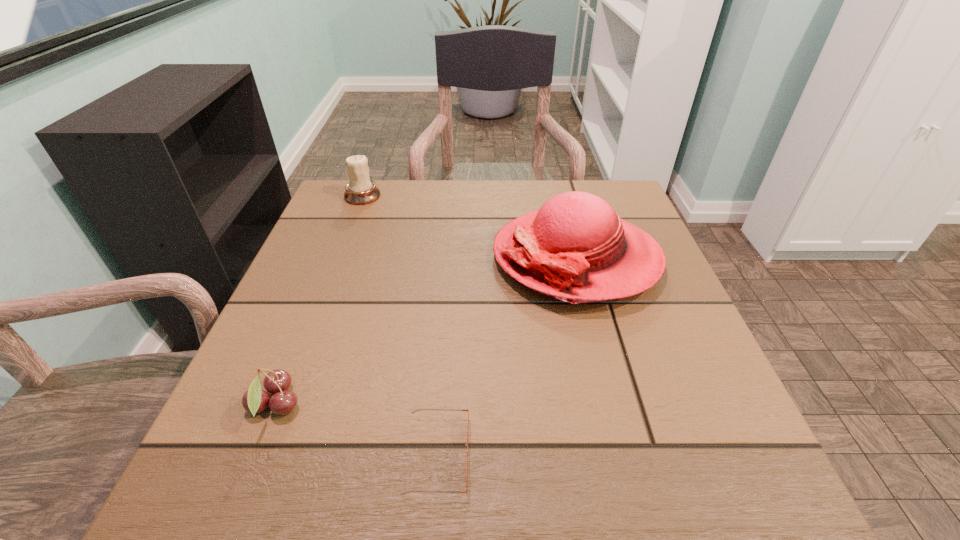
I want to click on object at the far right corner, so click(x=575, y=248).

At what (x,y) coordinates should I click in order to perform the action: click on vacant space at the far edge. Please return your answer as a coordinate pair (x, y). Looking at the image, I should click on (558, 180).

Where is `vacant space at the near edge of the desktop`? The image size is (960, 540). vacant space at the near edge of the desktop is located at coordinates (328, 463).

The height and width of the screenshot is (540, 960). Identify the location of free region at the left edge of the desktop. (351, 271).

Image resolution: width=960 pixels, height=540 pixels. I want to click on free spot at the far left corner of the desktop, so click(380, 226).

This screenshot has height=540, width=960. In the image, there is a desktop. What are the coordinates of `vacant space at the near left corner` in the screenshot? It's located at (288, 466).

Find the location of a particular element. The width and height of the screenshot is (960, 540). free space at the near right corner is located at coordinates (683, 463).

In order to click on vacant point located between the candle holder and the second shortest object in this screenshot , I will do point(319,300).

This screenshot has height=540, width=960. What are the coordinates of `free spot between the shortest object and the cherry` in the screenshot? It's located at (356, 430).

Where is `free space between the candle holder and the cherry`? Image resolution: width=960 pixels, height=540 pixels. free space between the candle holder and the cherry is located at coordinates (319, 300).